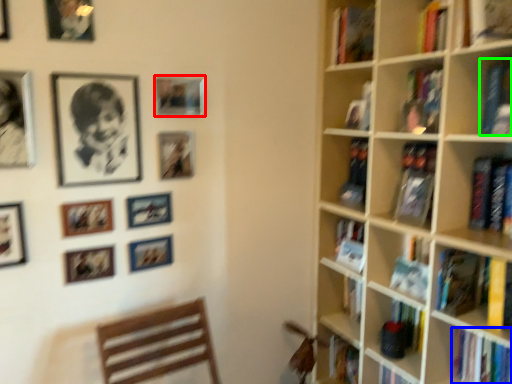
Question: Estimate the real-world distances between objects in this image. Which object is closer to picture frame (highlighted by a red box), book (highlighted by a blue box) or book (highlighted by a green box)?

Choices:
 (A) book
 (B) book

Answer: (B)